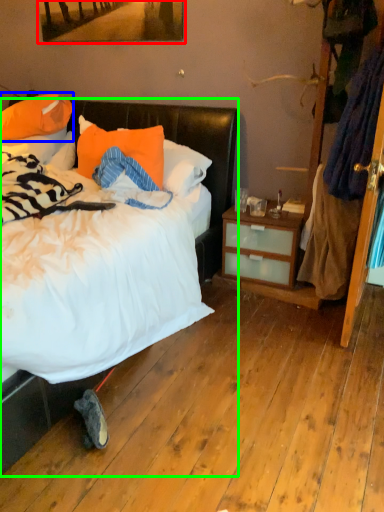
Question: Based on their relative distances, which object is nearer to picture frame (highlighted by a red box)? Choose from pillow (highlighted by a blue box) and bed (highlighted by a green box).

Choices:
 (A) pillow
 (B) bed

Answer: (B)